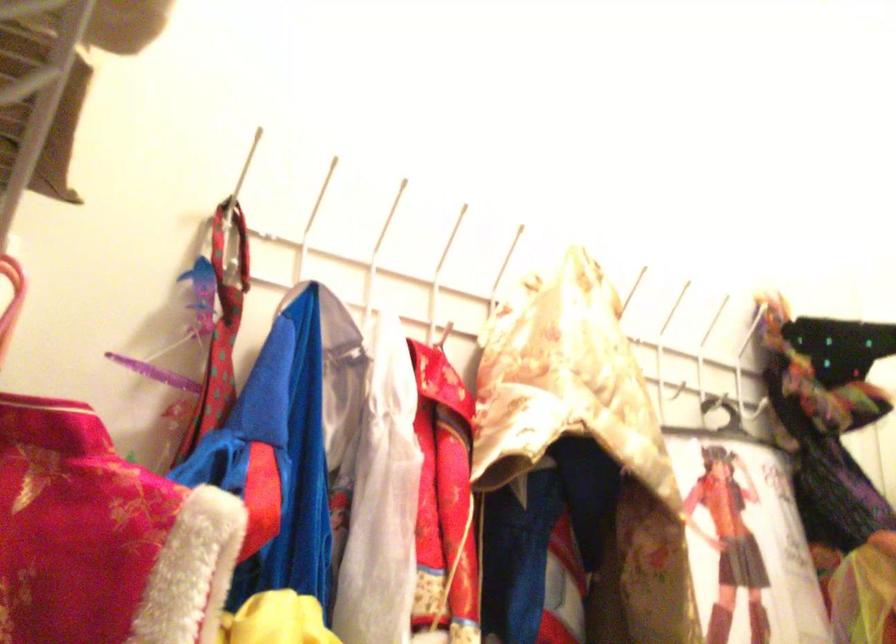
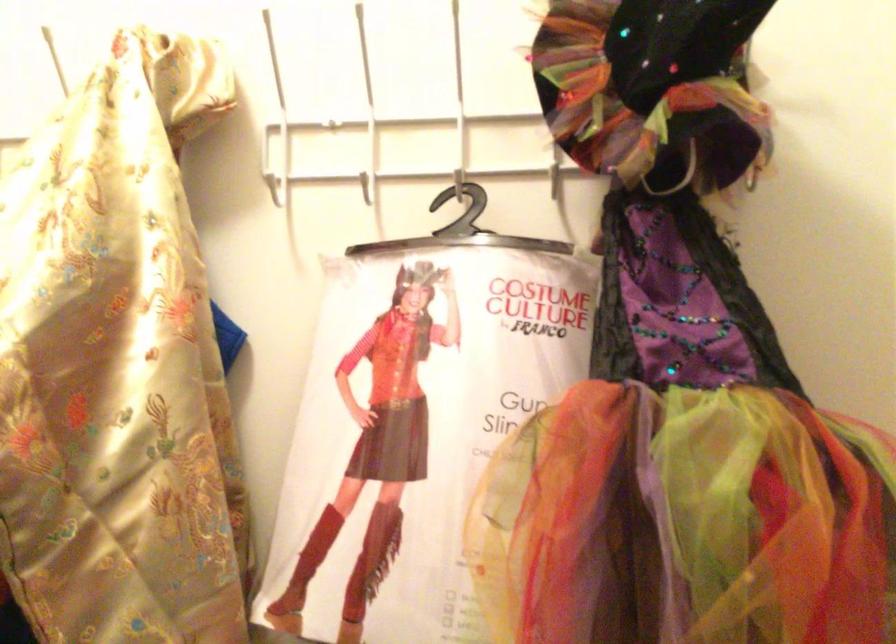
The point at (x=599, y=364) is marked in the first image. Where is the corresponding point in the second image?

(276, 189)